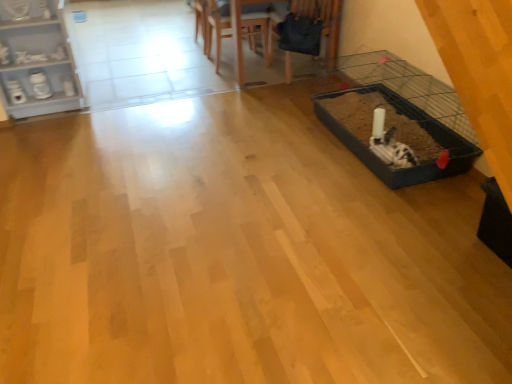
Question: Looking at their shapes, would you say wooden chair at upper center, positioned as the first armchair in left-to-right order, is wider or thinner than wooden table at upper center?

Choices:
 (A) thin
 (B) wide

Answer: (A)

Question: Considering the positions of wooden chair at upper center, positioned as the 3th armchair in right-to-left order, and wooden table at upper center in the image, is wooden chair at upper center, positioned as the 3th armchair in right-to-left order, taller or shorter than wooden table at upper center?

Choices:
 (A) tall
 (B) short

Answer: (B)

Question: Considering the real-world distances, which object is closest to the wooden chair at upper center, positioned as the 3th armchair in right-to-left order?

Choices:
 (A) wooden table at upper center
 (B) white painted wood shelf at upper left
 (C) velvet dark blue armchair at upper center, which ranks as the third armchair in left-to-right order
 (D) wooden chair at upper center, which ranks as the 2th armchair in left-to-right order

Answer: (D)

Question: Which of these objects is positioned farthest from the wooden table at upper center?

Choices:
 (A) white painted wood shelf at upper left
 (B) wooden chair at upper center, which is the 2th armchair in right-to-left order
 (C) wooden chair at upper center, positioned as the 3th armchair in right-to-left order
 (D) velvet dark blue armchair at upper center, which ranks as the third armchair in left-to-right order

Answer: (A)